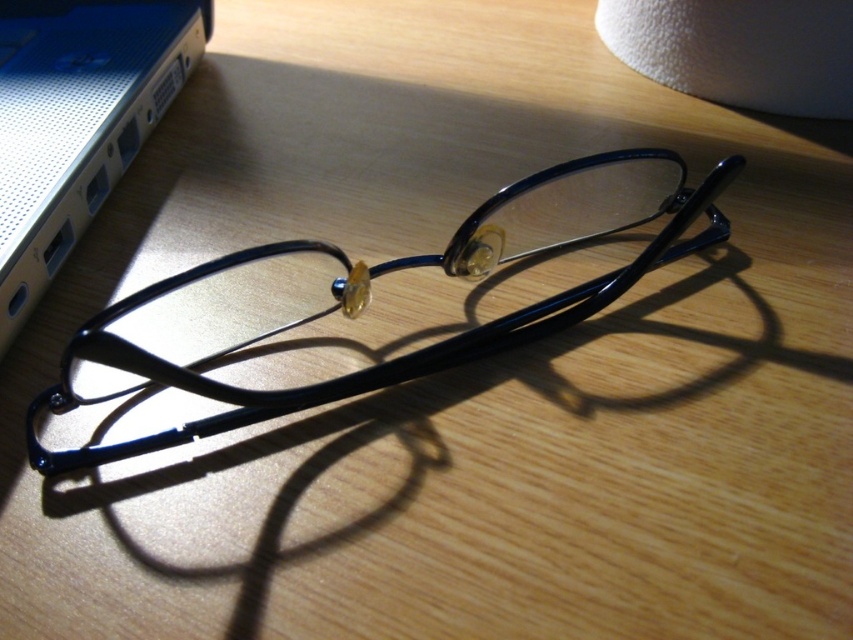
Question: Which of the following is the farthest from the observer?

Choices:
 (A) satin silver laptop at upper left
 (B) glossy plastic glasses at center

Answer: (A)

Question: Which object appears closest to the camera in this image?

Choices:
 (A) glossy plastic glasses at center
 (B) satin silver laptop at upper left

Answer: (A)

Question: Does glossy plastic glasses at center have a greater width compared to satin silver laptop at upper left?

Choices:
 (A) no
 (B) yes

Answer: (B)

Question: Is the position of glossy plastic glasses at center less distant than that of satin silver laptop at upper left?

Choices:
 (A) yes
 (B) no

Answer: (A)

Question: Does glossy plastic glasses at center have a larger size compared to satin silver laptop at upper left?

Choices:
 (A) yes
 (B) no

Answer: (A)